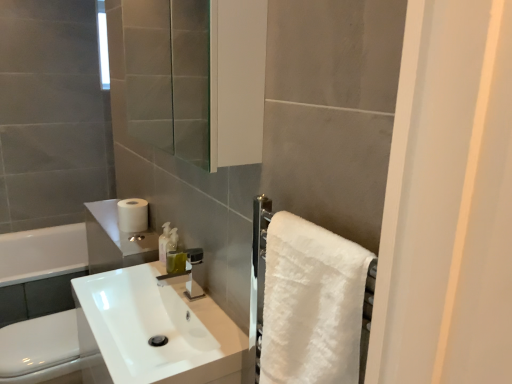
Question: Would you say translucent plastic soap dispenser at center is to the left or to the right of white glossy sink at center in the picture?

Choices:
 (A) left
 (B) right

Answer: (B)

Question: From a real-world perspective, is translucent plastic soap dispenser at center above or below white glossy sink at center?

Choices:
 (A) above
 (B) below

Answer: (A)

Question: Which object is positioned farthest from the translucent plastic soap dispenser at center?

Choices:
 (A) white fluffy towel at right
 (B) translucent plastic soap dispenser at center
 (C) white matte toilet paper at upper left
 (D) white glossy toilet bowl at lower left
 (E) white glossy sink at center

Answer: (A)

Question: Estimate the real-world distances between objects in this image. Which object is farther from the white matte toilet paper at upper left?

Choices:
 (A) white fluffy towel at right
 (B) white glossy toilet bowl at lower left
 (C) translucent plastic soap dispenser at center
 (D) white glossy sink at center
 (E) translucent plastic soap dispenser at center

Answer: (A)